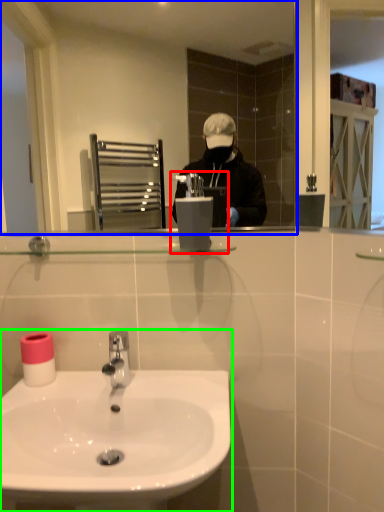
Question: Which object is positioned closest to hand dryer (highlighted by a red box)? Select from mirror (highlighted by a blue box) and sink (highlighted by a green box).

Choices:
 (A) mirror
 (B) sink

Answer: (B)